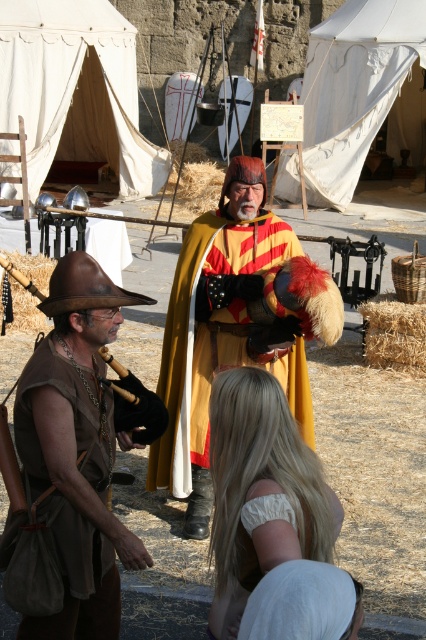
Question: Which object is closer to the camera taking this photo?

Choices:
 (A) brown leather cowboy hat at lower left
 (B) gold/yellow velvet cape at center
 (C) white canvas tent at upper left
 (D) brown leather hat at left

Answer: (D)

Question: Can you confirm if brown leather hat at left is positioned to the left of brown leather cowboy hat at lower left?

Choices:
 (A) yes
 (B) no

Answer: (B)

Question: Is brown leather hat at left smaller than white canvas tent at upper center?

Choices:
 (A) yes
 (B) no

Answer: (B)

Question: Does brown leather hat at left have a smaller size compared to brown leather cowboy hat at lower left?

Choices:
 (A) no
 (B) yes

Answer: (A)

Question: Which point is farther to the camera?

Choices:
 (A) brown leather cowboy hat at lower left
 (B) white canvas tent at upper center
 (C) brown straw at left
 (D) gold/yellow velvet cape at center

Answer: (B)

Question: Which of the following is the closest to the observer?

Choices:
 (A) brown leather cowboy hat at lower left
 (B) white canvas tent at upper center
 (C) brown straw at left

Answer: (A)